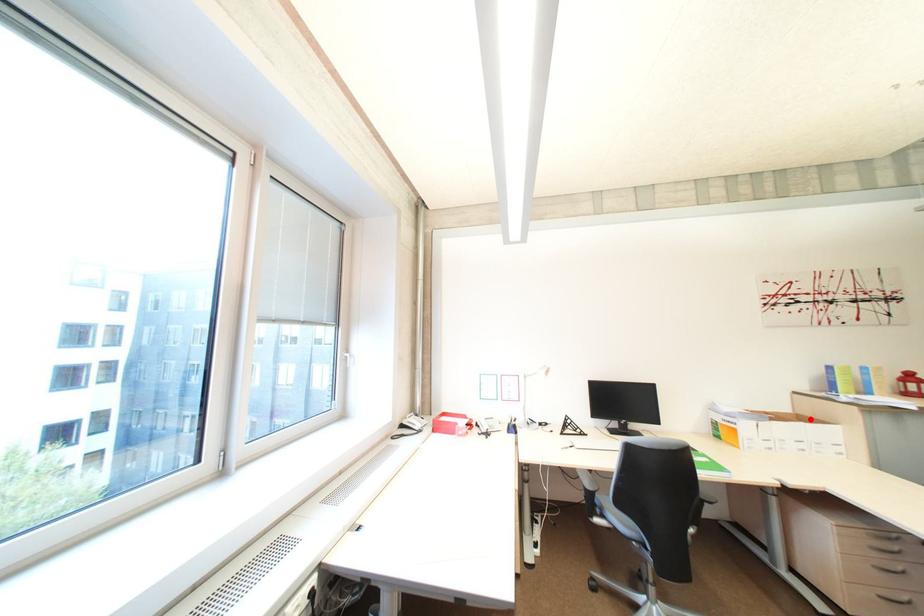
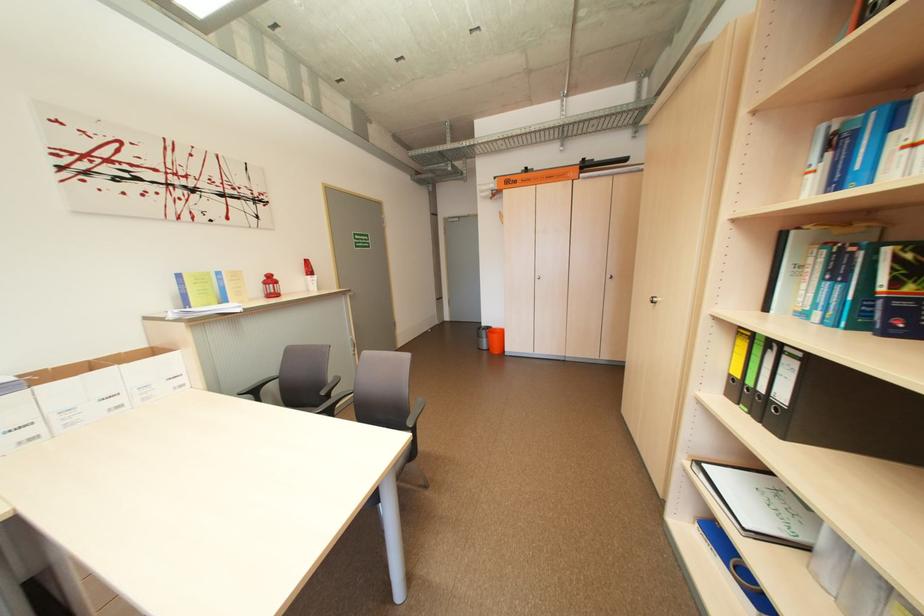
Question: I am providing you with two images of the same scene from different viewpoints. In image1, a red point is highlighted. Considering the same 3D point in image2, which of the following is correct?

Choices:
 (A) It is closer
 (B) It is farther

Answer: (B)